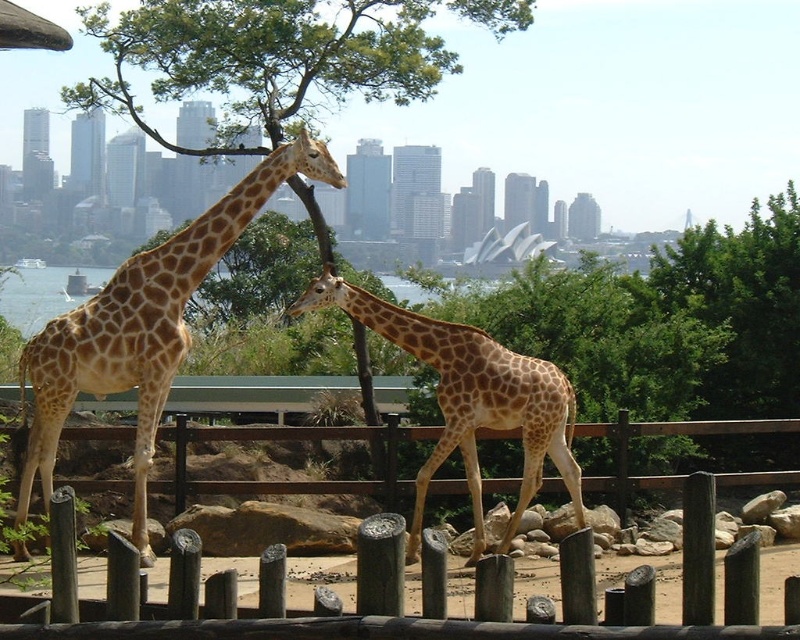
Consider the image. You are standing in front of the giraffe enclosure at the zoo. You notice two points marked on the ground at coordinates point [42,332] and point [468,406]. Which point is closer to you?

Point [42,332] is in front of point [468,406], so it is closer to you.

You are a zookeeper standing in front of the wooden post fence at center and the spotted fur giraffe at center. You need to place a new feeding trough between them. Based on their positions, which object should the trough be closer to?

The wooden post fence at center is positioned on the left side of the spotted fur giraffe at center, so the feeding trough should be placed closer to the wooden post fence at center since it is to the left of the giraffe.